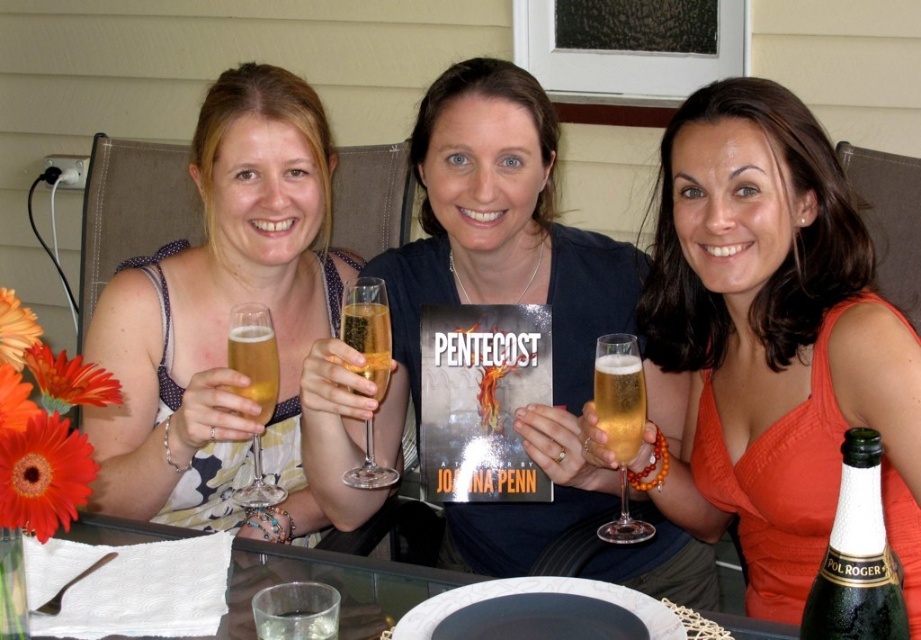
Based on the photo, is orange fabric dress at center bigger than matte floral dress at center?

Actually, orange fabric dress at center might be smaller than matte floral dress at center.

Is point (747, 99) more distant than point (270, 292)?

No, it is in front of (270, 292).

In order to click on orange fabric dress at center in this screenshot , I will do `click(772, 342)`.

Image resolution: width=921 pixels, height=640 pixels. What do you see at coordinates (481, 301) in the screenshot?
I see `matte black book at center` at bounding box center [481, 301].

I want to click on matte black book at center, so click(481, 301).

Is orange fabric dress at center positioned at the back of green glass bottle at lower right?

Yes, orange fabric dress at center is further from the viewer.

Who is more distant from viewer, (840, 324) or (818, 627)?

Positioned behind is point (840, 324).

At what (x,y) coordinates should I click in order to perform the action: click on orange fabric dress at center. Please return your answer as a coordinate pair (x, y). This screenshot has height=640, width=921. Looking at the image, I should click on (772, 342).